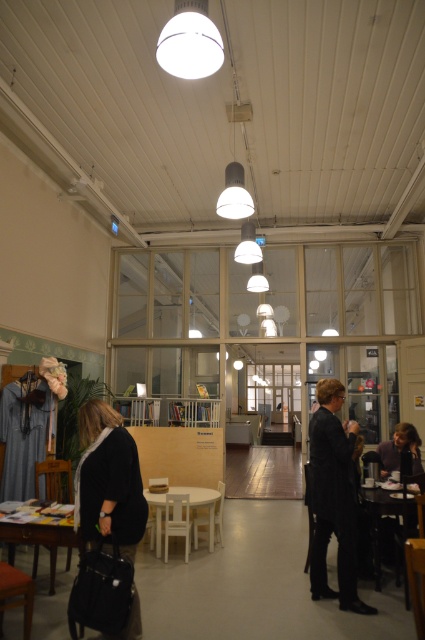
You are organizing a charity event and need to place a decorative item on the white matte table at center. However, you notice the velvet black coat at lower left nearby. Considering their heights, is the table tall enough to place the item without it being obscured by the coat?

The velvet black coat at lower left is taller than the white matte table at center. Therefore, placing a decorative item on the white matte table at center may result in it being obscured by the taller coat.